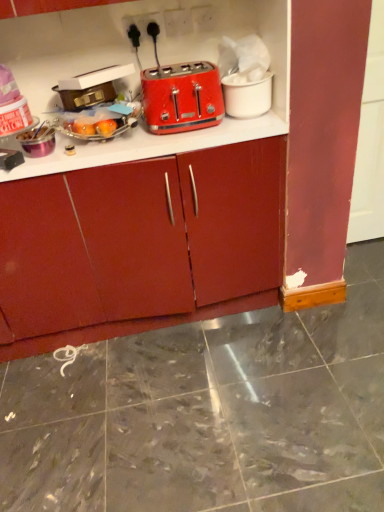
Question: Considering the relative sizes of matte plastic toaster at upper center and metallic gold suitcase at upper left, placed as the 2th appliance when sorted from right to left, in the image provided, is matte plastic toaster at upper center shorter than metallic gold suitcase at upper left, placed as the 2th appliance when sorted from right to left,?

Choices:
 (A) yes
 (B) no

Answer: (B)

Question: Does matte plastic toaster at upper center lie behind metallic gold suitcase at upper left, the first appliance positioned from the left?

Choices:
 (A) no
 (B) yes

Answer: (A)

Question: From the image's perspective, is matte plastic toaster at upper center below metallic gold suitcase at upper left, placed as the 2th appliance when sorted from right to left?

Choices:
 (A) yes
 (B) no

Answer: (B)

Question: Can you confirm if matte plastic toaster at upper center is thinner than metallic gold suitcase at upper left, the first appliance positioned from the left?

Choices:
 (A) no
 (B) yes

Answer: (A)

Question: From a real-world perspective, is matte plastic toaster at upper center positioned over metallic gold suitcase at upper left, the first appliance positioned from the left, based on gravity?

Choices:
 (A) yes
 (B) no

Answer: (B)

Question: Considering the positions of matte red cabinet at center and metallic gold suitcase at upper left, placed as the 2th appliance when sorted from right to left, in the image, is matte red cabinet at center taller or shorter than metallic gold suitcase at upper left, placed as the 2th appliance when sorted from right to left,?

Choices:
 (A) short
 (B) tall

Answer: (B)

Question: Is matte red cabinet at center wider or thinner than metallic gold suitcase at upper left, the first appliance positioned from the left?

Choices:
 (A) thin
 (B) wide

Answer: (B)

Question: Considering the positions of point (114, 274) and point (91, 104), is point (114, 274) closer or farther from the camera than point (91, 104)?

Choices:
 (A) farther
 (B) closer

Answer: (A)

Question: From a real-world perspective, is matte red cabinet at center positioned above or below metallic gold suitcase at upper left, the first appliance positioned from the left?

Choices:
 (A) above
 (B) below

Answer: (B)

Question: From a real-world perspective, is metallic gold suitcase at upper left, the first appliance positioned from the left, positioned above or below matte red cabinet at center?

Choices:
 (A) below
 (B) above

Answer: (B)

Question: Is metallic gold suitcase at upper left, placed as the 2th appliance when sorted from right to left, in front of or behind matte red cabinet at center in the image?

Choices:
 (A) front
 (B) behind

Answer: (B)

Question: Is metallic gold suitcase at upper left, placed as the 2th appliance when sorted from right to left, situated inside matte red cabinet at center or outside?

Choices:
 (A) outside
 (B) inside

Answer: (A)

Question: From the image's perspective, is metallic gold suitcase at upper left, the first appliance positioned from the left, located above or below matte red cabinet at center?

Choices:
 (A) above
 (B) below

Answer: (A)

Question: From the image's perspective, relative to matte plastic toaster at upper center, is white matte cup at upper right, which is the first appliance in right-to-left order, above or below?

Choices:
 (A) below
 (B) above

Answer: (B)

Question: Considering the positions of white matte cup at upper right, which is the first appliance in right-to-left order, and matte plastic toaster at upper center in the image, is white matte cup at upper right, which is the first appliance in right-to-left order, bigger or smaller than matte plastic toaster at upper center?

Choices:
 (A) big
 (B) small

Answer: (B)